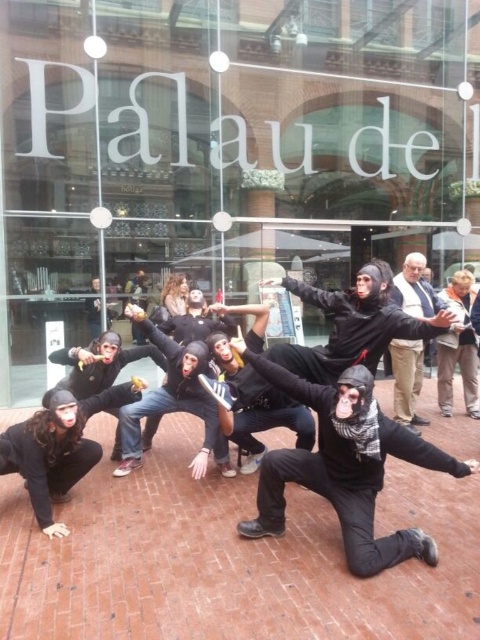
You are a photographer trying to capture the matte black mask at lower left and the khaki cotton pants at center in a single frame. Based on their heights, which object should you focus on first to ensure both are in focus?

The matte black mask at lower left has a lesser height compared to the khaki cotton pants at center, so you should focus on the khaki cotton pants at center first to ensure both are in focus.

You are a delivery person trying to see the menu inside the shop through the transparent glass shop window at center. However, there is a matte black mask at lower left blocking your view. Can you see the menu clearly?

The transparent glass shop window at center is above the matte black mask at lower left, so the mask is below the window. Since the mask is not in front of the window, you can see the menu clearly through the transparent glass shop window at center.